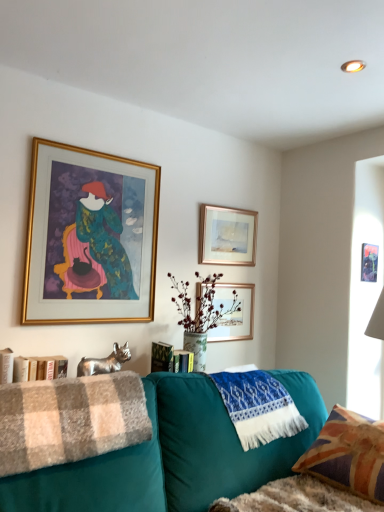
Question: Is union jack fabric pillow at lower right turned away from gold-framed picture at upper center, which is counted as the third picture frame, starting from the right?

Choices:
 (A) no
 (B) yes

Answer: (B)

Question: Is union jack fabric pillow at lower right touching gold-framed picture at upper center, which ranks as the 2th picture frame in left-to-right order?

Choices:
 (A) yes
 (B) no

Answer: (B)

Question: From a real-world perspective, is union jack fabric pillow at lower right on gold-framed picture at upper center, which is counted as the third picture frame, starting from the right?

Choices:
 (A) yes
 (B) no

Answer: (B)

Question: Does union jack fabric pillow at lower right have a larger size compared to gold-framed picture at upper center, which ranks as the 2th picture frame in left-to-right order?

Choices:
 (A) yes
 (B) no

Answer: (A)

Question: Is union jack fabric pillow at lower right taller than gold-framed picture at upper center, which is counted as the third picture frame, starting from the right?

Choices:
 (A) yes
 (B) no

Answer: (A)

Question: From a real-world perspective, is plush beige checkered blanket at lower left above or below blue knitted blanket at lower center?

Choices:
 (A) below
 (B) above

Answer: (B)

Question: From the image's perspective, is plush beige checkered blanket at lower left located above or below blue knitted blanket at lower center?

Choices:
 (A) above
 (B) below

Answer: (A)

Question: Which is correct: plush beige checkered blanket at lower left is inside blue knitted blanket at lower center, or outside of it?

Choices:
 (A) outside
 (B) inside

Answer: (A)

Question: Based on their sizes in the image, would you say plush beige checkered blanket at lower left is bigger or smaller than blue knitted blanket at lower center?

Choices:
 (A) big
 (B) small

Answer: (B)

Question: Is gold-framed picture at upper center, which is counted as the third picture frame, starting from the right, bigger or smaller than blue knitted blanket at lower center?

Choices:
 (A) small
 (B) big

Answer: (A)

Question: Considering the positions of gold-framed picture at upper center, which is counted as the third picture frame, starting from the right, and blue knitted blanket at lower center in the image, is gold-framed picture at upper center, which is counted as the third picture frame, starting from the right, taller or shorter than blue knitted blanket at lower center?

Choices:
 (A) short
 (B) tall

Answer: (B)

Question: From a real-world perspective, is gold-framed picture at upper center, which is counted as the third picture frame, starting from the right, physically located above or below blue knitted blanket at lower center?

Choices:
 (A) below
 (B) above

Answer: (B)

Question: From the image's perspective, is gold-framed picture at upper center, which ranks as the 2th picture frame in left-to-right order, positioned above or below blue knitted blanket at lower center?

Choices:
 (A) below
 (B) above

Answer: (B)

Question: From the image's perspective, is union jack fabric pillow at lower right above or below gold-framed artwork at upper left, placed as the 4th picture frame when sorted from right to left?

Choices:
 (A) below
 (B) above

Answer: (A)

Question: From their relative heights in the image, would you say union jack fabric pillow at lower right is taller or shorter than gold-framed artwork at upper left, the 1th picture frame when ordered from left to right?

Choices:
 (A) short
 (B) tall

Answer: (A)